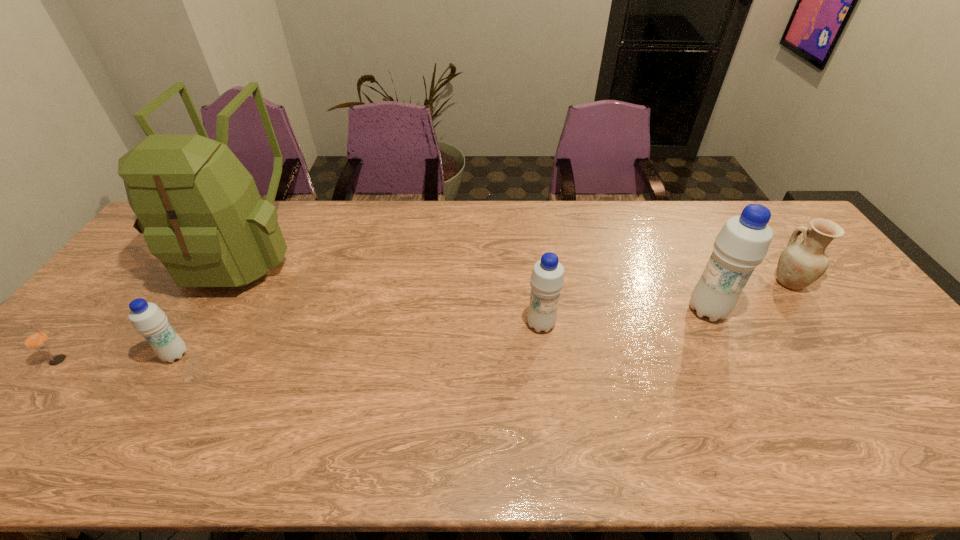
This screenshot has width=960, height=540. Find the location of `location for an additional water_bottle to make spacing equal`. location for an additional water_bottle to make spacing equal is located at coordinates (364, 339).